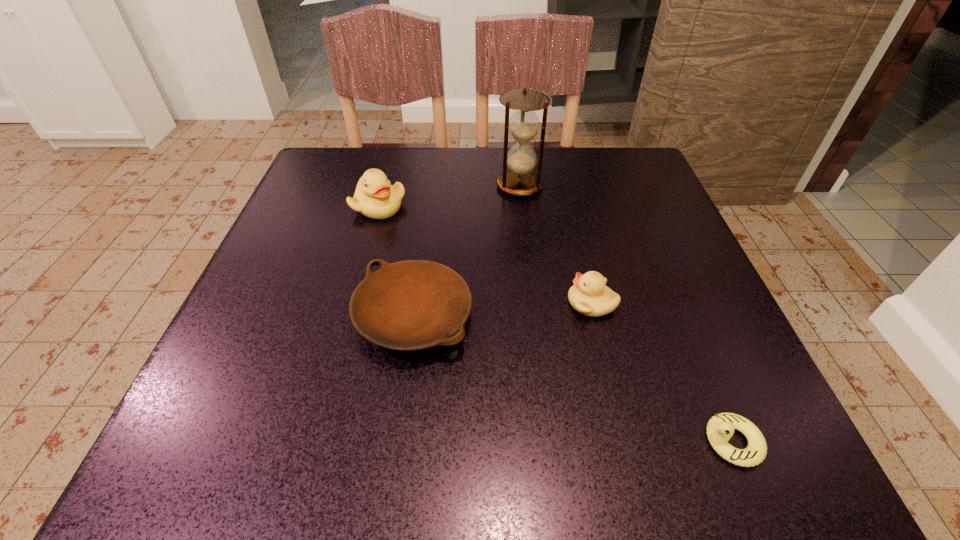
This screenshot has height=540, width=960. I want to click on object situated at the near edge, so click(720, 428).

Identify the location of object that is at the left edge. (375, 197).

Identify the location of object positioned at the right edge. The image size is (960, 540). 720,428.

Find the location of `object positioned at the far left corner`. object positioned at the far left corner is located at coordinates (375, 197).

Image resolution: width=960 pixels, height=540 pixels. I want to click on object positioned at the near right corner, so click(x=720, y=428).

Find the location of a particular element. blank space at the far edge of the desktop is located at coordinates (553, 183).

Where is `vacant space at the left edge of the desktop`? This screenshot has height=540, width=960. vacant space at the left edge of the desktop is located at coordinates (288, 217).

Identify the location of vacant space at the right edge. This screenshot has height=540, width=960. (710, 347).

Find the location of `vacant space at the far left corner of the desktop`. vacant space at the far left corner of the desktop is located at coordinates (332, 176).

In the image, there is a desktop. Where is `free space at the far right corner`? Image resolution: width=960 pixels, height=540 pixels. free space at the far right corner is located at coordinates (636, 187).